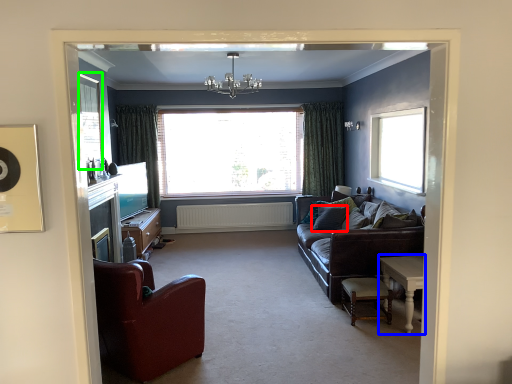
Question: Based on their relative distances, which object is nearer to pillow (highlighted by a red box)? Choose from table (highlighted by a blue box) and window screen (highlighted by a green box).

Choices:
 (A) table
 (B) window screen

Answer: (A)